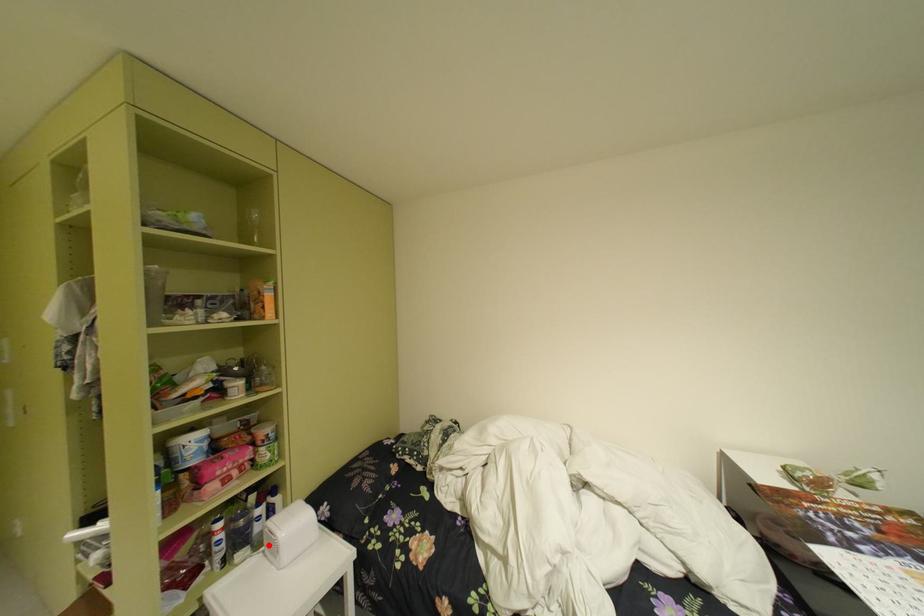
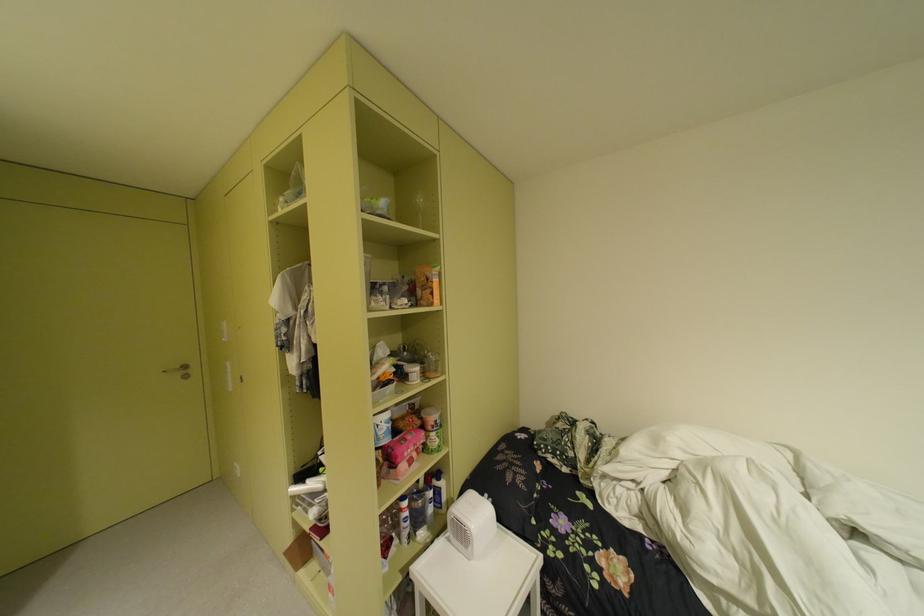
Locate, in the second image, the point that corresponds to the highlighted location in the first image.

(451, 529)